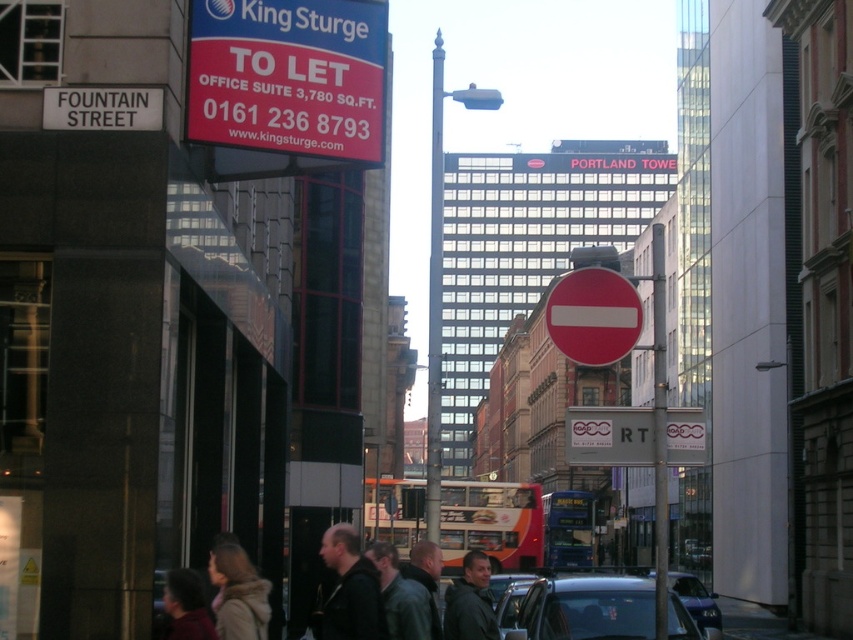
What is the purpose of the point at coordinate (x=287, y=84) in the scene?

The point at coordinate (x=287, y=84) indicates a matte plastic sign at upper left advertising office space for King Sturge.

What is the relationship in terms of vertical positioning between the matte plastic sign at upper left and the dark gray jacket at center?

The matte plastic sign at upper left is positioned above the dark gray jacket at center.

You are a delivery person standing at the point with coordinates point (573,330) and need to deliver a package to point (212,636). Which direction should you move to reach your destination?

You should move away from the viewer because point (212,636) is further away from the viewer compared to point (573,330).